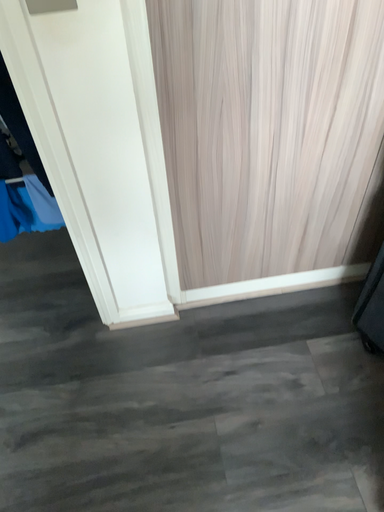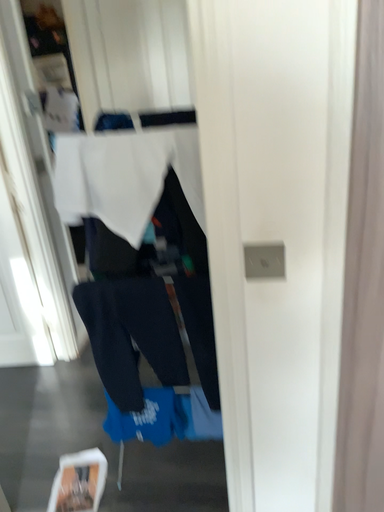
Question: How did the camera likely rotate when shooting the video?

Choices:
 (A) rotated right
 (B) rotated left

Answer: (B)